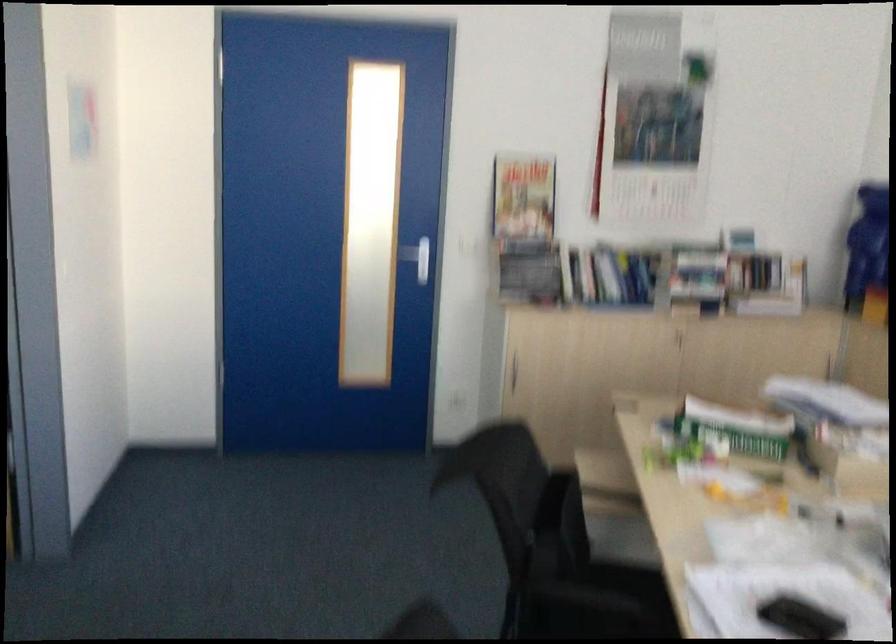
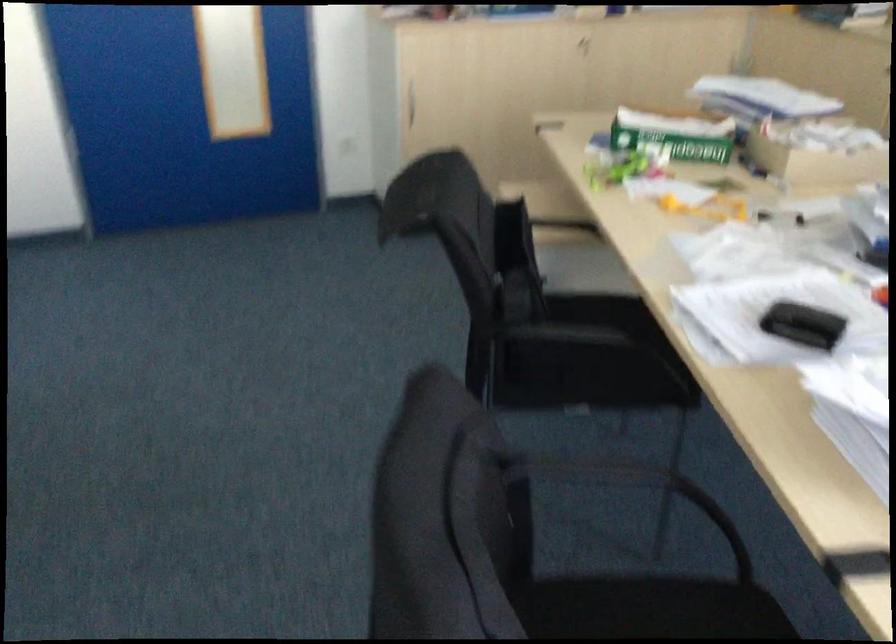
Which direction would the cameraman need to move to produce the second image?

The cameraman moved toward left, forward.